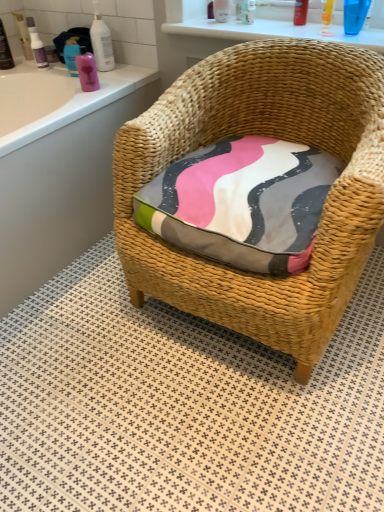
Where is `free space to the left of translucent plastic bottle at upper center, placed as the fourth toiletry when sorted from right to left`? The image size is (384, 512). free space to the left of translucent plastic bottle at upper center, placed as the fourth toiletry when sorted from right to left is located at coordinates click(190, 22).